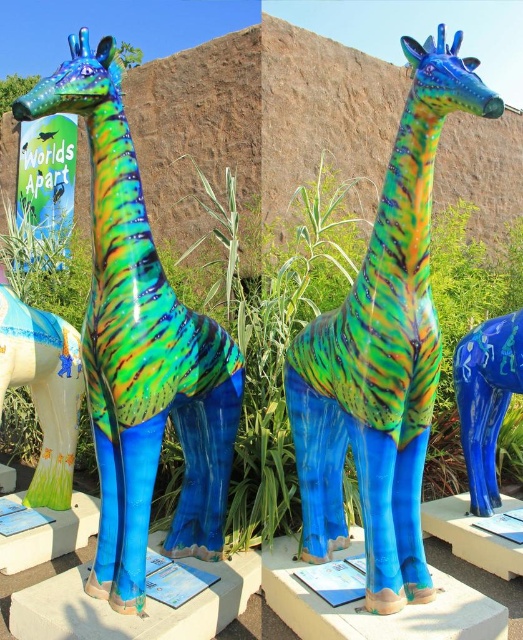
You are a delivery robot that needs to place a new sculpture between the glossy ceramic giraffe at center and the shiny ceramic giraffe at center. The sculpture is 50 centimeters wide. Can you fit it between them without moving the existing giraffes?

The distance between the glossy ceramic giraffe at center and the shiny ceramic giraffe at center is 65.77 centimeters. Since the new sculpture is 50 centimeters wide, there is enough space to place it between them without moving the existing giraffes.

Based on the photo, you are standing in front of the two ceramic giraffe sculptures at the exhibit. Which one is positioned closer to you between the glossy ceramic giraffe at center and the shiny ceramic giraffe at center?

The glossy ceramic giraffe at center is closer to the viewer than the shiny ceramic giraffe at center.

You are an art curator planning to install a new sculpture in the same exhibit. The new sculpture will be placed at the point marked by the coordinates point (141,349). What type of sculpture is currently located at that position?

The point (141,349) marks the location of the shiny ceramic giraffe at center.